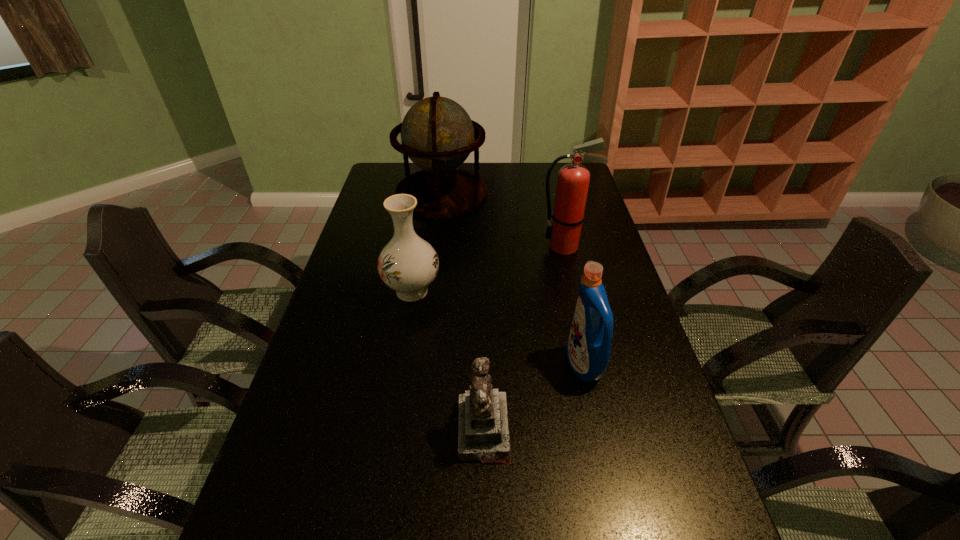
This screenshot has height=540, width=960. Find the location of `vacant space located on the left of the third nearest object`. vacant space located on the left of the third nearest object is located at coordinates (347, 291).

The height and width of the screenshot is (540, 960). Identify the location of vacant space located on the label of the fourth farthest object. (439, 364).

Where is `free location located 0.310m on the label of the fourth farthest object`? Image resolution: width=960 pixels, height=540 pixels. free location located 0.310m on the label of the fourth farthest object is located at coordinates (446, 364).

Find the location of a particular element. This screenshot has width=960, height=540. free space located on the label of the fourth farthest object is located at coordinates (486, 364).

Where is `free point located 0.360m on the front-facing side of the nearest object`? This screenshot has width=960, height=540. free point located 0.360m on the front-facing side of the nearest object is located at coordinates (299, 430).

Identify the location of vacant space situated on the front-facing side of the nearest object. The image size is (960, 540). click(x=356, y=430).

At what (x,y) coordinates should I click in order to perform the action: click on free space located 0.270m on the front-facing side of the nearest object. Please return your answer as a coordinate pair (x, y). This screenshot has width=960, height=540. Looking at the image, I should click on (339, 430).

Image resolution: width=960 pixels, height=540 pixels. What are the coordinates of `object that is at the far edge` in the screenshot? It's located at (437, 134).

Identify the location of globe that is at the left edge. (437, 134).

Where is `vase present at the left edge`? This screenshot has width=960, height=540. vase present at the left edge is located at coordinates click(x=408, y=264).